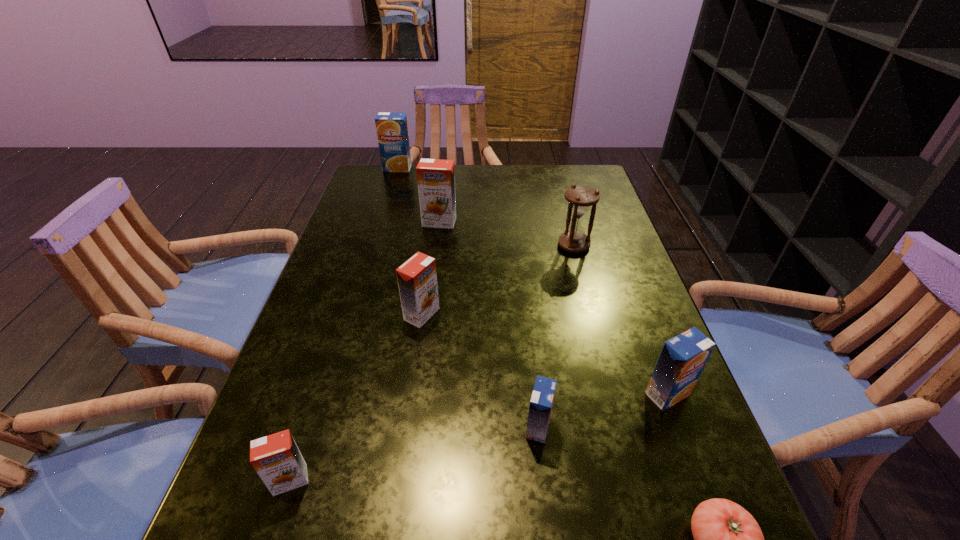
I want to click on the leftmost blue orange_juice, so click(x=392, y=131).

In order to click on the biggest blue orange_juice in this screenshot , I will do `click(392, 131)`.

Image resolution: width=960 pixels, height=540 pixels. I want to click on the farthest orange orange juice, so click(x=436, y=181).

In order to click on the biggest orange orange juice in this screenshot , I will do `click(436, 181)`.

Find the location of a particular element. the third object from right to left is located at coordinates (580, 197).

Where is `hourglass`? Image resolution: width=960 pixels, height=540 pixels. hourglass is located at coordinates coord(580,197).

Where is `the fourth farthest object`? This screenshot has height=540, width=960. the fourth farthest object is located at coordinates (417, 278).

Image resolution: width=960 pixels, height=540 pixels. I want to click on the second nearest orange orange juice, so click(417, 278).

You are a GUI agent. You are given a task and a screenshot of the screen. Output one action in this format:
    pyautogui.click(x=<x>, y=<y>)
    Task: Click on the second biggest blue orange_juice
    This screenshot has width=960, height=540.
    Given the screenshot: What is the action you would take?
    pyautogui.click(x=683, y=358)

Identify the location of the rightmost orange juice. (683, 358).